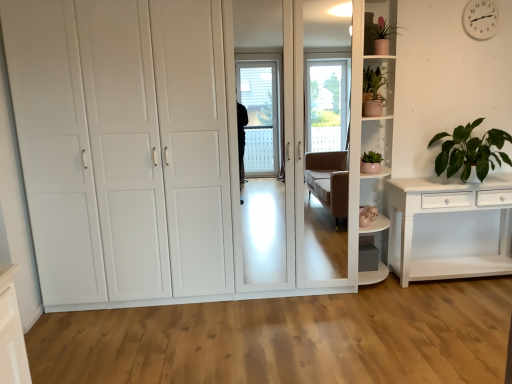
Question: Is green leafy plant at right, the 3th houseplant viewed from the left, turned away from matte pink pot at upper right, the 3th houseplant when ordered from right to left?

Choices:
 (A) no
 (B) yes

Answer: (A)

Question: From the image's perspective, is green leafy plant at right, marked as the first houseplant in a right-to-left arrangement, under matte pink pot at upper right, the 3th houseplant when ordered from right to left?

Choices:
 (A) yes
 (B) no

Answer: (B)

Question: Is the depth of green leafy plant at right, marked as the first houseplant in a right-to-left arrangement, less than that of matte pink pot at upper right, acting as the 1th houseplant starting from the left?

Choices:
 (A) no
 (B) yes

Answer: (B)

Question: Is green leafy plant at right, the 3th houseplant viewed from the left, at the left side of matte pink pot at upper right, the 3th houseplant when ordered from right to left?

Choices:
 (A) yes
 (B) no

Answer: (B)

Question: Is green leafy plant at right, marked as the first houseplant in a right-to-left arrangement, taller than matte pink pot at upper right, acting as the 1th houseplant starting from the left?

Choices:
 (A) no
 (B) yes

Answer: (B)

Question: Considering the relative sizes of green leafy plant at right, the 3th houseplant viewed from the left, and matte pink pot at upper right, the 3th houseplant when ordered from right to left, in the image provided, is green leafy plant at right, the 3th houseplant viewed from the left, thinner than matte pink pot at upper right, the 3th houseplant when ordered from right to left,?

Choices:
 (A) no
 (B) yes

Answer: (A)

Question: Is white glossy cupboard at center bigger than white glossy shelf at upper right, the first shelf positioned from the bottom?

Choices:
 (A) yes
 (B) no

Answer: (A)

Question: Can you confirm if white glossy cupboard at center is shorter than white glossy shelf at upper right, which is counted as the 2th shelf, starting from the top?

Choices:
 (A) no
 (B) yes

Answer: (A)

Question: Does white glossy cupboard at center appear on the right side of white glossy shelf at upper right, the first shelf positioned from the bottom?

Choices:
 (A) yes
 (B) no

Answer: (B)

Question: Is white glossy cupboard at center in contact with white glossy shelf at upper right, which is counted as the 2th shelf, starting from the top?

Choices:
 (A) no
 (B) yes

Answer: (A)

Question: Can we say white glossy cupboard at center lies outside white glossy shelf at upper right, which is counted as the 2th shelf, starting from the top?

Choices:
 (A) yes
 (B) no

Answer: (A)

Question: Does white glossy cupboard at center come in front of white glossy shelf at upper right, the first shelf positioned from the bottom?

Choices:
 (A) no
 (B) yes

Answer: (B)

Question: Is white plastic clock at upper right beside green leafy plant at right, the 3th houseplant viewed from the left?

Choices:
 (A) yes
 (B) no

Answer: (B)